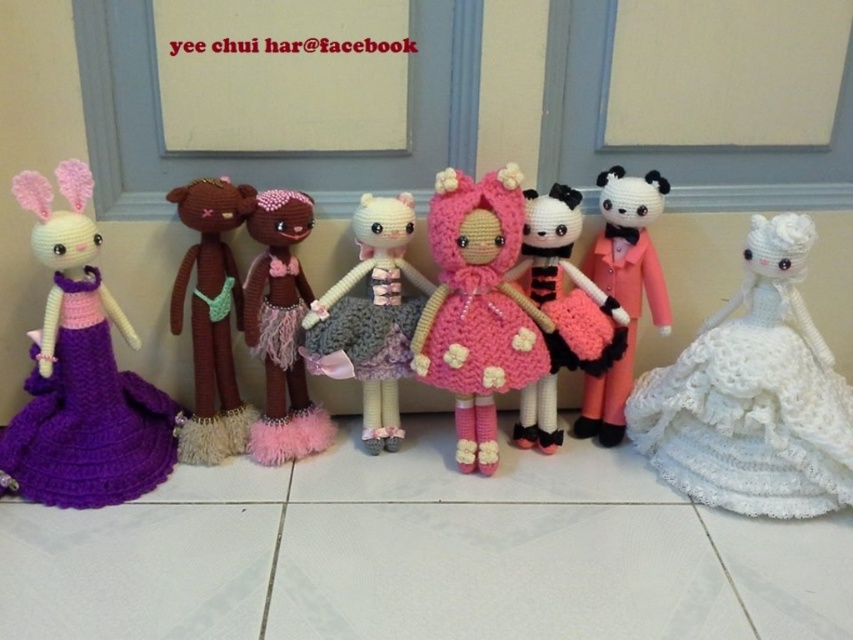
You are a GUI agent. You are given a task and a screenshot of the screen. Output one action in this format:
    pyautogui.click(x=<x>, y=<y>)
    Task: Click on the pink crocheted dress at center
    This screenshot has width=853, height=640.
    Given the screenshot: What is the action you would take?
    pyautogui.click(x=477, y=307)

Which of these two, pink crocheted dress at center or brown yarn doll at center, stands shorter?

brown yarn doll at center is shorter.

Does point (439, 208) come farther from viewer compared to point (260, 273)?

That is False.

Locate an element on the screen. pink crocheted dress at center is located at coordinates (477, 307).

How distant is white knitted dress at right from pink crocheted dress at center?

11.53 inches

Is white knitted dress at right in front of pink crocheted dress at center?

Yes, it is in front of pink crocheted dress at center.

You are a GUI agent. You are given a task and a screenshot of the screen. Output one action in this format:
    pyautogui.click(x=<x>, y=<y>)
    Task: Click on the white knitted dress at right
    This screenshot has height=640, width=853.
    Given the screenshot: What is the action you would take?
    pyautogui.click(x=750, y=412)

Where is `white knitted dress at right`? The image size is (853, 640). white knitted dress at right is located at coordinates (750, 412).

Between brown yarn teddy bear at center and brown yarn doll at center, which one appears on the right side from the viewer's perspective?

brown yarn doll at center is more to the right.

Which is more to the left, brown yarn teddy bear at center or brown yarn doll at center?

From the viewer's perspective, brown yarn teddy bear at center appears more on the left side.

Between point (216, 417) and point (268, 360), which one is positioned behind?

Positioned behind is point (216, 417).

At what (x,y) coordinates should I click in order to perform the action: click on brown yarn teddy bear at center. Please return your answer as a coordinate pair (x, y). The image size is (853, 640). Looking at the image, I should click on (212, 317).